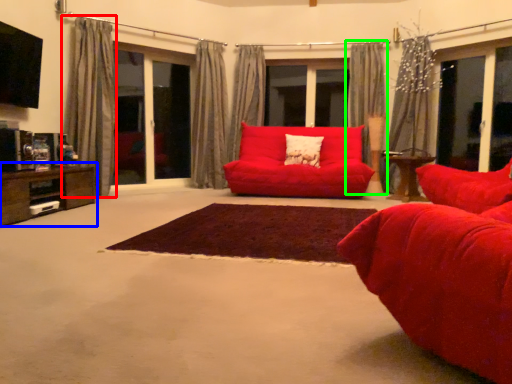
Question: Based on their relative distances, which object is nearer to curtain (highlighted by a red box)? Choose from table (highlighted by a blue box) and curtain (highlighted by a green box).

Choices:
 (A) table
 (B) curtain

Answer: (A)